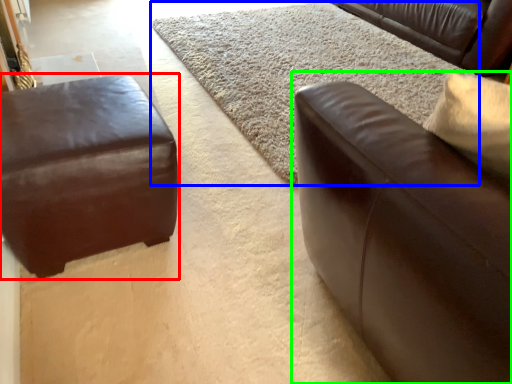
Question: Based on their relative distances, which object is nearer to studio couch (highlighted by a red box)? Choose from mat (highlighted by a blue box) and studio couch (highlighted by a green box).

Choices:
 (A) mat
 (B) studio couch

Answer: (B)